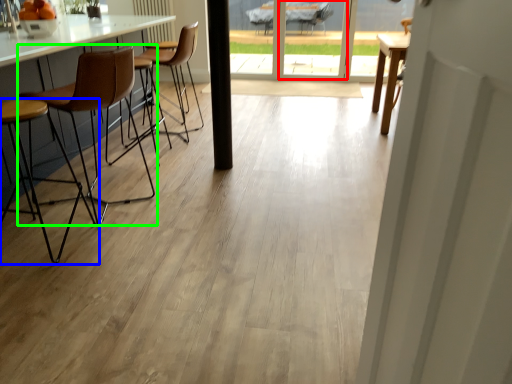
Question: Estimate the real-world distances between objects in this image. Which object is farther from screen door (highlighted by a red box), chair (highlighted by a blue box) or chair (highlighted by a green box)?

Choices:
 (A) chair
 (B) chair

Answer: (A)